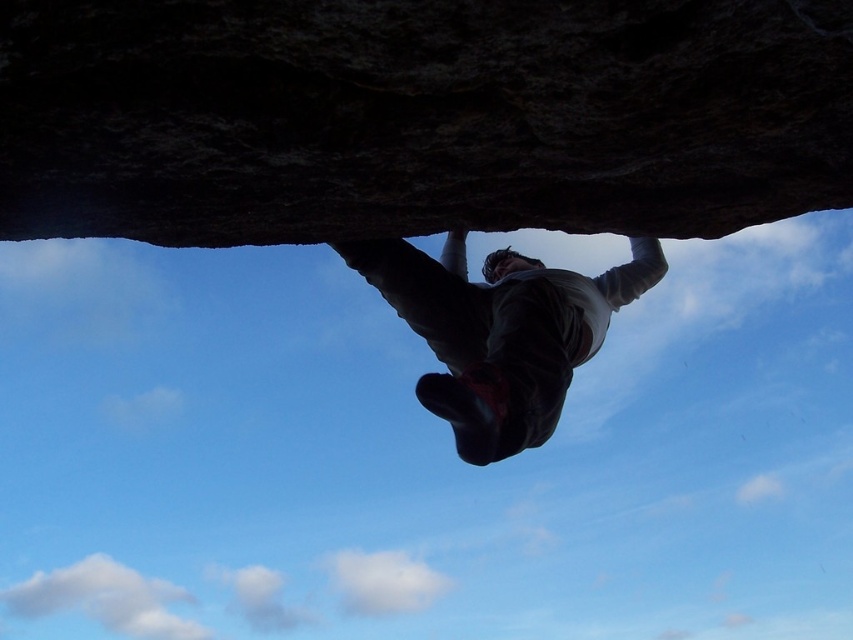
You are a photographer positioned below the climber. You want to capture a photo that includes both the dark rock cliff at upper center and the dark gray fabric climbing harness at center. Based on their positions, which object should you adjust your camera to focus on first to ensure both are in the frame?

The dark rock cliff at upper center is to the left of the dark gray fabric climbing harness at center, so you should focus on the dark gray fabric climbing harness at center first to ensure both are included in the frame.

In the scene shown: You are a photographer positioned below the climber and want to capture a photo where the dark rock cliff at upper center is in focus while keeping the dark gray fabric climbing harness at center visible but slightly blurred. Is this possible given their positions?

The dark rock cliff at upper center is closer to the viewer than the dark gray fabric climbing harness at center. By focusing on the closer object, the harness will naturally be out of focus, creating the desired effect.